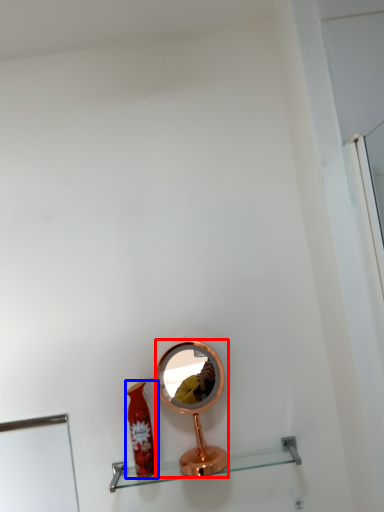
Question: Among these objects, which one is nearest to the camera, mirror (highlighted by a red box) or bottle (highlighted by a blue box)?

Choices:
 (A) mirror
 (B) bottle

Answer: (B)